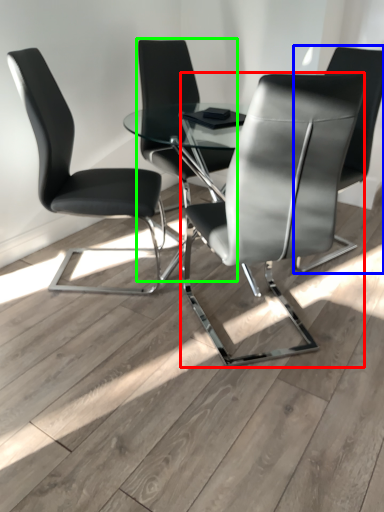
Question: Which object is the closest to the chair (highlighted by a red box)? Choose among these: chair (highlighted by a blue box) or chair (highlighted by a green box).

Choices:
 (A) chair
 (B) chair

Answer: (A)